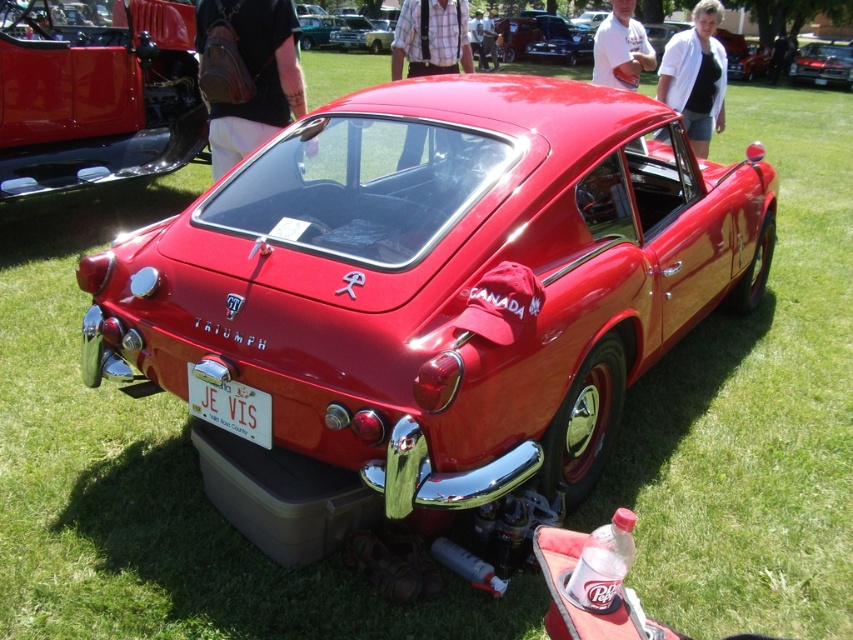
You are a photographer at a car show who wants to capture both the matte red car at upper left and the glossy red car at upper right in a single shot. Which car should you position closer to the camera to ensure both appear balanced in size?

To balance the size of both cars in the photo, position the glossy red car at upper right closer to the camera since it is shorter than the matte red car at upper left. This adjustment will make them appear more similar in size in the final image.

You are a photographer at a car show and want to capture the matte red car at upper left and the white plastic license plate at center in the same frame. Which object should you position closer to the left side of your camera viewfinder to ensure both are included?

The matte red car at upper left is positioned on the left side of white plastic license plate at center, so you should position the matte red car at upper left closer to the left side of your camera viewfinder to include both in the frame.